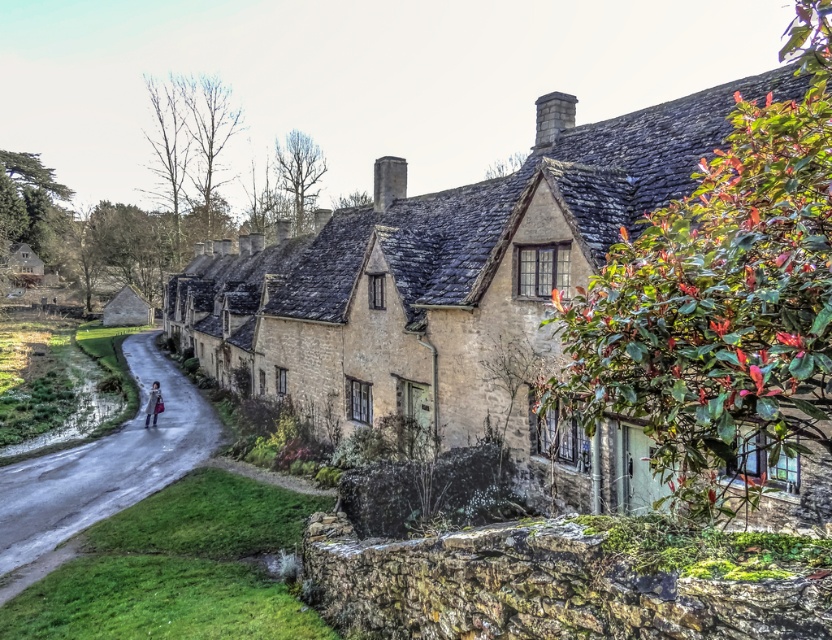
Question: Can you confirm if stone cottage at center is positioned to the left of matte pink coat at road center?

Choices:
 (A) no
 (B) yes

Answer: (A)

Question: Can you confirm if stone cottage at center is positioned to the left of matte pink coat at road center?

Choices:
 (A) yes
 (B) no

Answer: (B)

Question: Which point is closer to the camera taking this photo?

Choices:
 (A) (399, 384)
 (B) (154, 422)

Answer: (A)

Question: Can you confirm if stone cottage at center is positioned above matte pink coat at road center?

Choices:
 (A) no
 (B) yes

Answer: (B)

Question: Which object is farther from the camera taking this photo?

Choices:
 (A) stone cottage at center
 (B) matte pink coat at road center

Answer: (B)

Question: Which point is closer to the camera?

Choices:
 (A) matte pink coat at road center
 (B) stone cottage at center

Answer: (B)